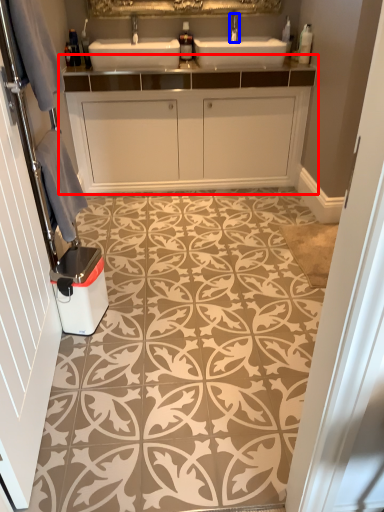
Question: Which object is further to the camera taking this photo, bathroom cabinet (highlighted by a red box) or tap (highlighted by a blue box)?

Choices:
 (A) bathroom cabinet
 (B) tap

Answer: (B)